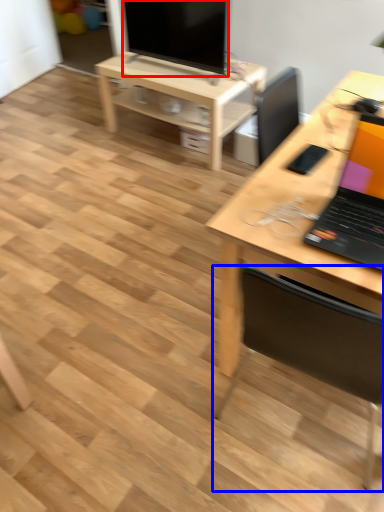
Question: Which object is closer to the camera taking this photo, television (highlighted by a red box) or chair (highlighted by a blue box)?

Choices:
 (A) television
 (B) chair

Answer: (B)